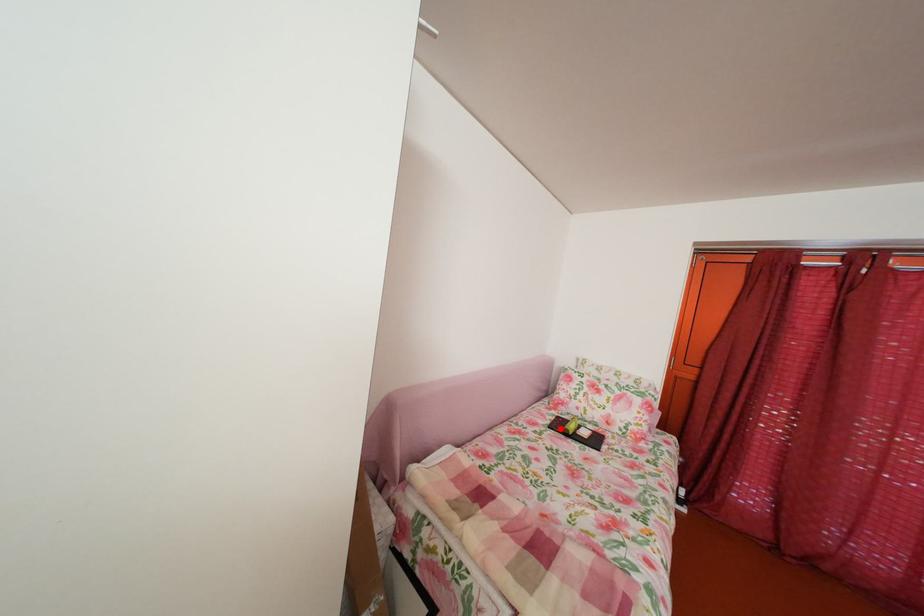
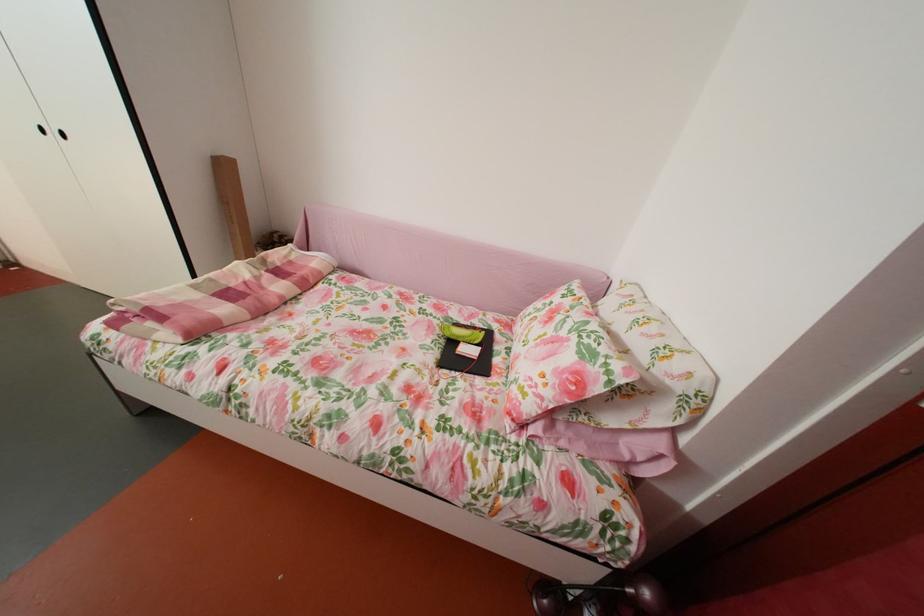
In the second image, find the point that corresponds to the highlighted location in the first image.

(473, 328)